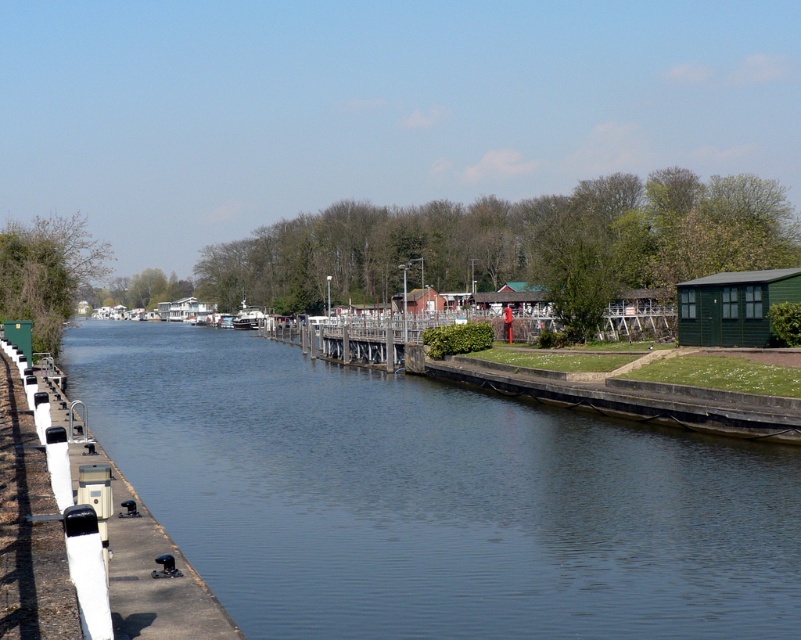
You are a boat operator trying to navigate the metallic gray boat at center through the smooth concrete river at center. Based on the scene description, can the boat pass through the river? Explain why or why not.

The smooth concrete river at center is shorter than the metallic gray boat at center. Therefore, the boat cannot pass through the river because the river is not long enough to accommodate the boat.